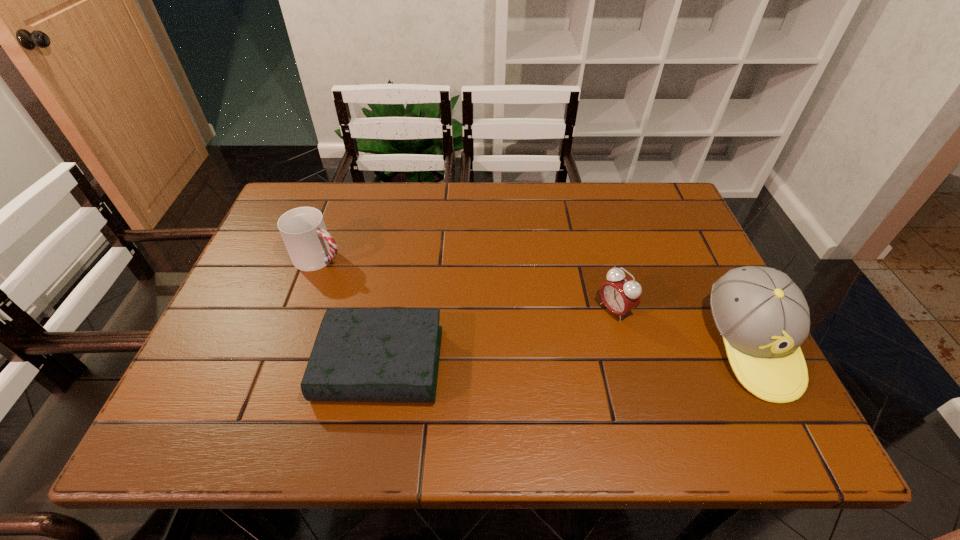
Identify the location of vacant space at the near edge of the desktop. This screenshot has height=540, width=960. (634, 382).

Identify the location of vacant space at the left edge of the desktop. The width and height of the screenshot is (960, 540). (259, 298).

Identify the location of blank area at the right edge. (674, 298).

Image resolution: width=960 pixels, height=540 pixels. I want to click on free space at the far right corner, so click(x=681, y=227).

Locate an element on the screen. free point between the baseball cap and the alarm clock is located at coordinates (683, 328).

Image resolution: width=960 pixels, height=540 pixels. What are the coordinates of `free area in between the tallest object and the Bible` in the screenshot? It's located at (565, 355).

Image resolution: width=960 pixels, height=540 pixels. Find the location of `free space between the farthest object and the rightmost object`. free space between the farthest object and the rightmost object is located at coordinates (536, 301).

Image resolution: width=960 pixels, height=540 pixels. What are the coordinates of `blank region between the cup and the second object from right to left` in the screenshot? It's located at pos(468,284).

Locate an element on the screen. Image resolution: width=960 pixels, height=540 pixels. free point between the leftmost object and the alarm clock is located at coordinates [x=468, y=284].

Identify the location of free spot between the shortest object and the baseball cap. The image size is (960, 540). coord(565,355).